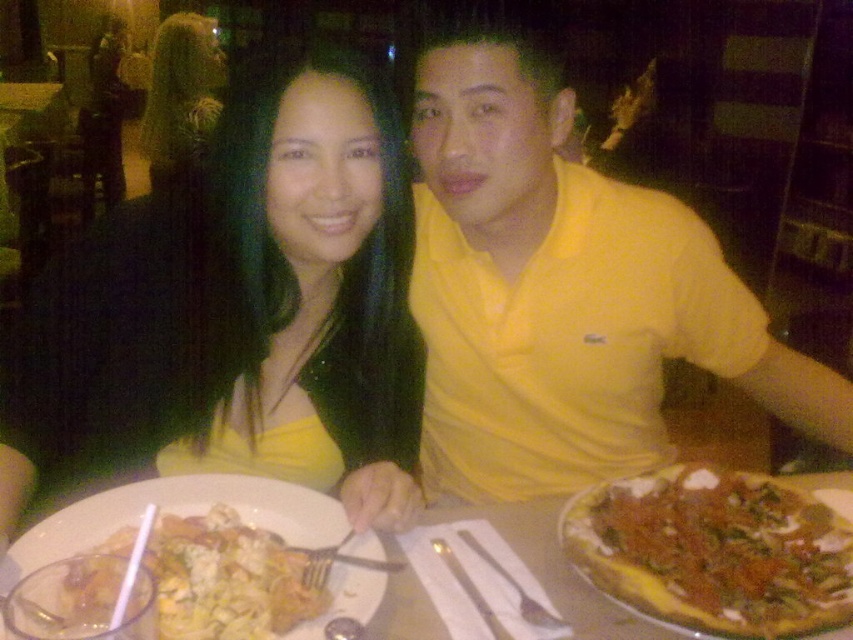
Question: Is golden crispy pizza at center below yellow cheesy pasta at center?

Choices:
 (A) yes
 (B) no

Answer: (B)

Question: Based on their relative distances, which object is nearer to the yellow cheesy pasta at center?

Choices:
 (A) golden crispy pizza at center
 (B) yellow matte dress at center
 (C) shiny black hair at center
 (D) yellow matte shirt at center

Answer: (B)

Question: Does golden crispy pizza at center have a lesser width compared to shiny black hair at center?

Choices:
 (A) no
 (B) yes

Answer: (B)

Question: Which object is the closest to the yellow matte dress at center?

Choices:
 (A) yellow cheesy pasta at center
 (B) golden crispy pizza at center
 (C) shiny black hair at center
 (D) yellow matte shirt at center

Answer: (D)

Question: Is yellow matte shirt at center to the left of golden crispy pizza at center from the viewer's perspective?

Choices:
 (A) no
 (B) yes

Answer: (B)

Question: Which point appears farthest from the camera in this image?

Choices:
 (A) (583, 504)
 (B) (546, 216)

Answer: (B)